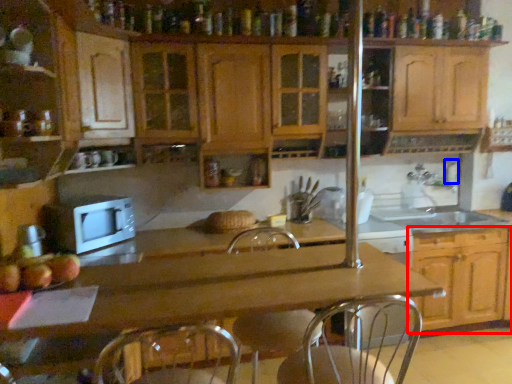
Question: Which point is closer to the camera, cabinetry (highlighted by a red box) or faucet (highlighted by a blue box)?

Choices:
 (A) cabinetry
 (B) faucet

Answer: (A)